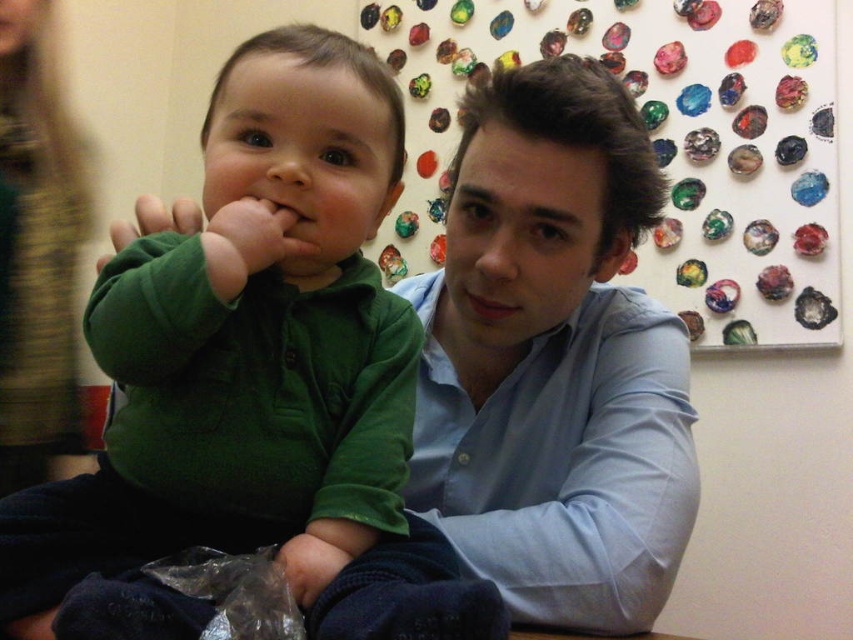
In the image, there is a point located at coordinates (286, 244). Based on the scene description, what type of material is this point likely resting on?

The point at (286, 244) is on green soft fabric at center.

You are a photographer trying to capture the exact location of the point at coordinates (553,358) in the image. Based on the scene described, where would this point be located?

The point at coordinates (553,358) is located on the light blue shirt at center.